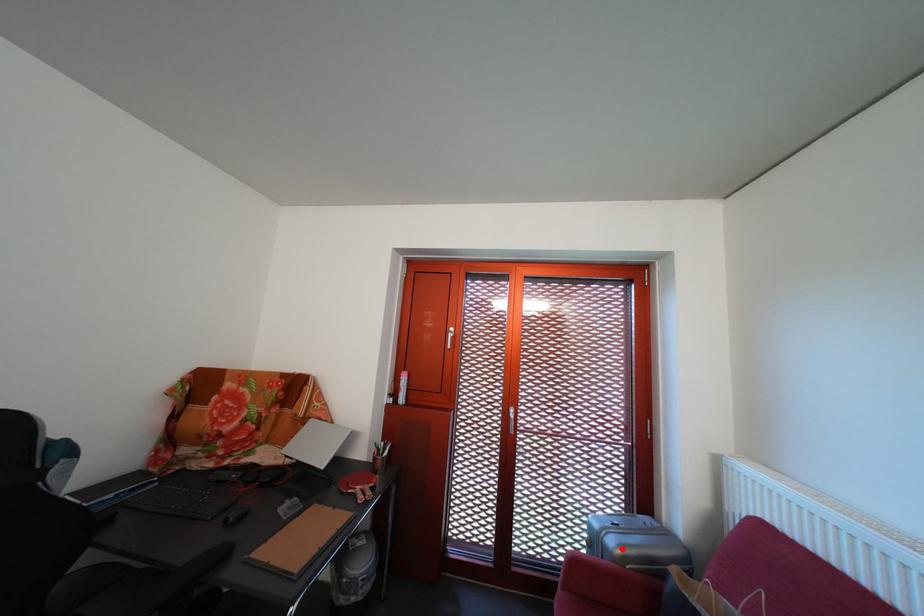
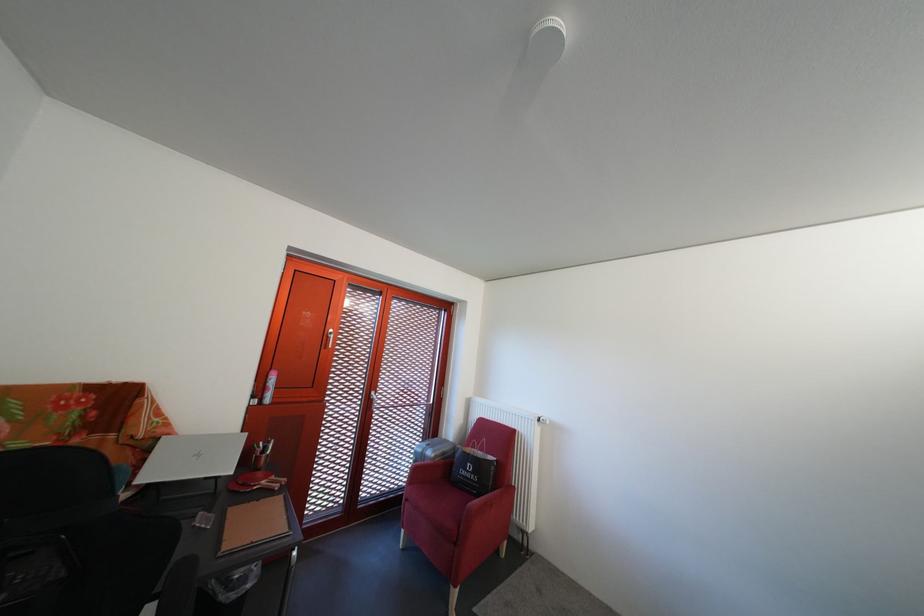
Find the pixel in the second image that matches the highlighted location in the first image.

(441, 459)